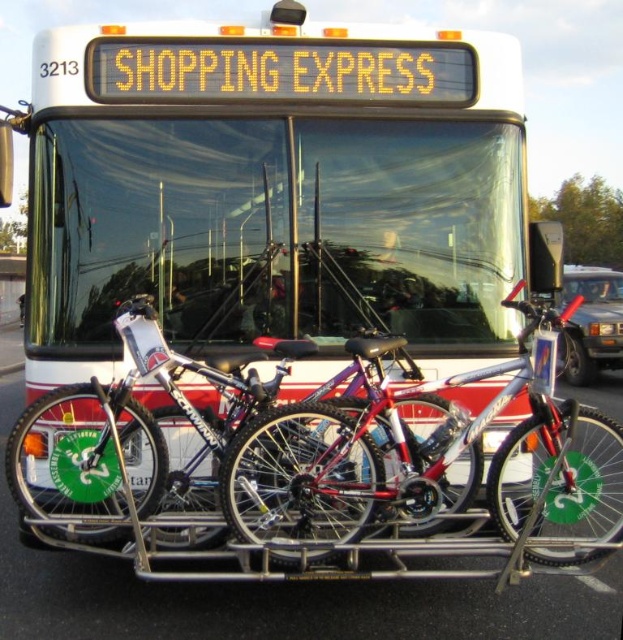
Question: Can you confirm if white matte bus at center is thinner than shiny silver bicycle at center?

Choices:
 (A) no
 (B) yes

Answer: (A)

Question: Which of the following is the farthest from the observer?

Choices:
 (A) pyautogui.click(x=83, y=493)
 (B) pyautogui.click(x=287, y=276)

Answer: (B)

Question: Does white matte bus at center lie in front of shiny silver bicycle at center?

Choices:
 (A) yes
 (B) no

Answer: (B)

Question: Can you confirm if shiny metallic bicycle at center is positioned above shiny silver bicycle at center?

Choices:
 (A) yes
 (B) no

Answer: (B)

Question: Based on their relative distances, which object is nearer to the shiny metallic bicycle at center?

Choices:
 (A) white matte bus at center
 (B) shiny silver bicycle at center

Answer: (B)

Question: Which point appears closest to the camera in this image?

Choices:
 (A) (140, 333)
 (B) (307, 477)

Answer: (B)